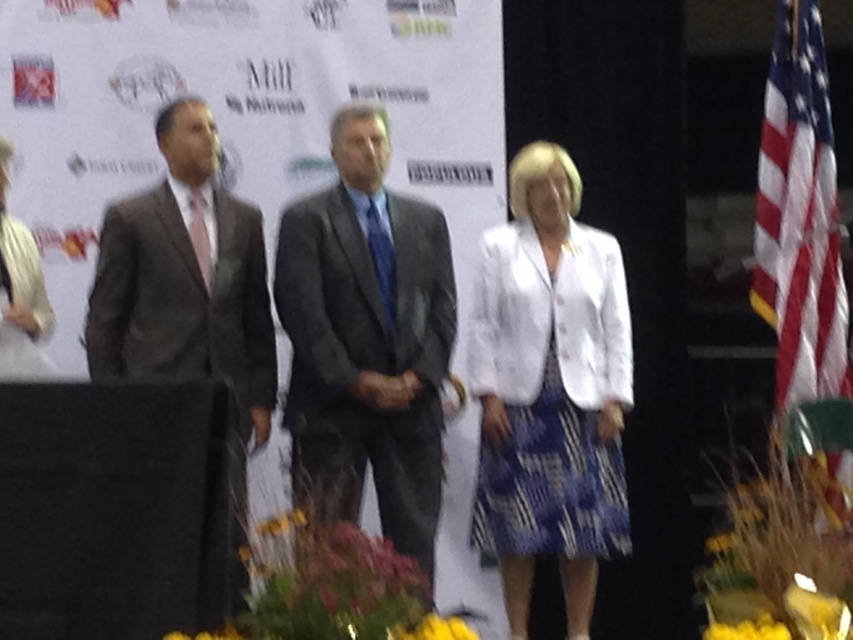
Question: Does dark gray suit at center appear on the right side of dark gray textured suit at left?

Choices:
 (A) yes
 (B) no

Answer: (A)

Question: Which of the following is the closest to the observer?

Choices:
 (A) (509, 342)
 (B) (746, 620)

Answer: (B)

Question: Is white textured blazer at center above dark gray textured suit at left?

Choices:
 (A) yes
 (B) no

Answer: (B)

Question: Considering the real-world distances, which object is closest to the dark gray textured suit at left?

Choices:
 (A) american flag at right
 (B) yellow fabric flower at lower right

Answer: (B)

Question: Among these points, which one is nearest to the camera?

Choices:
 (A) (724, 636)
 (B) (553, 474)
 (C) (819, 365)
 (D) (413, 630)

Answer: (D)

Question: Does white textured blazer at center lie in front of yellow fabric flower at lower center?

Choices:
 (A) yes
 (B) no

Answer: (B)